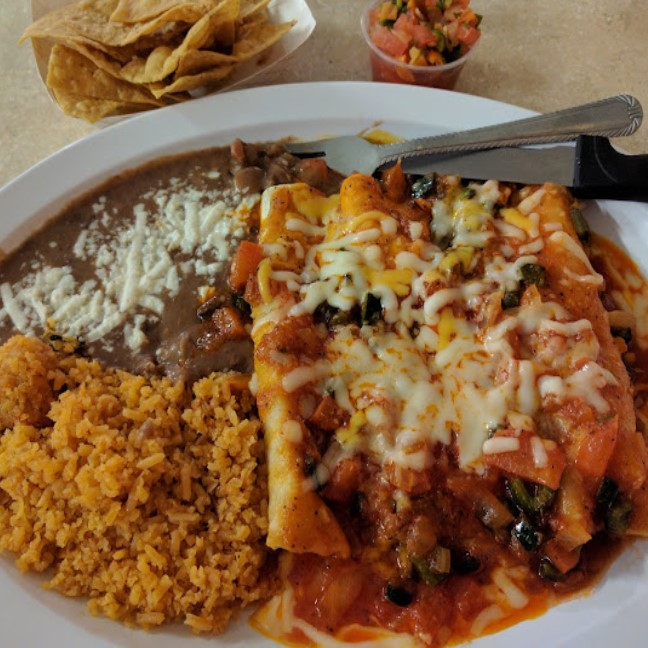
Where is `black handle`? black handle is located at coordinates (614, 175).